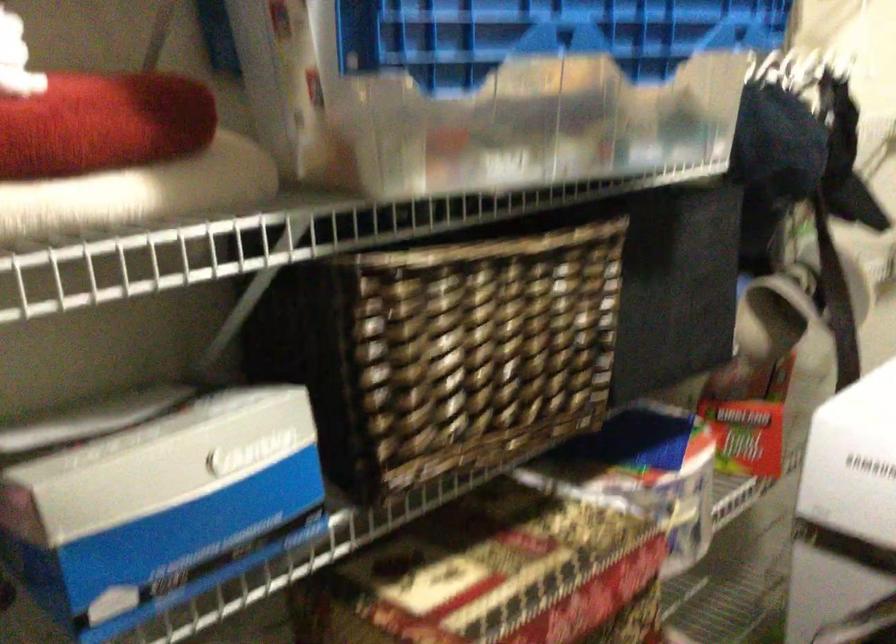
Where would you pull the plastic storage bin? Please return your answer as a coordinate pair (x, y).

(468, 114)